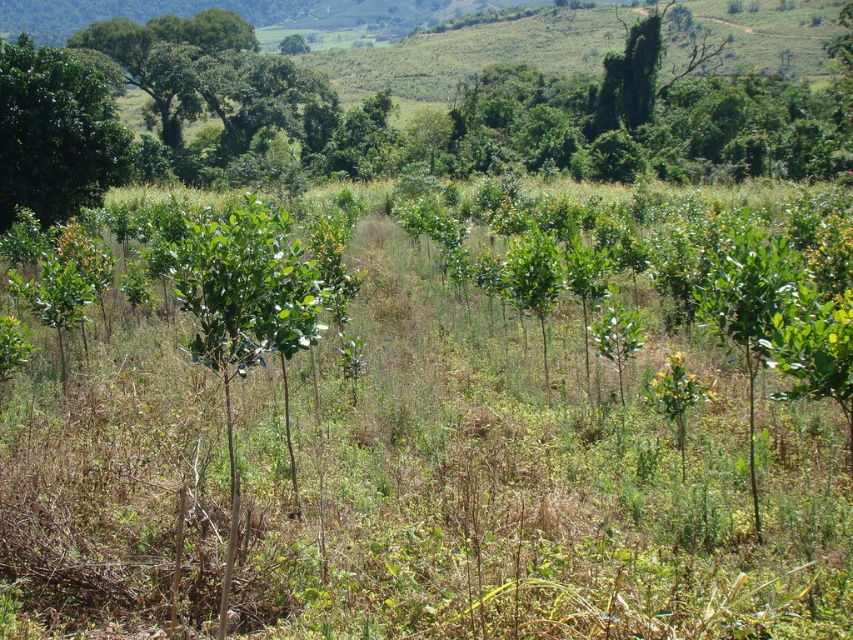
Is green leafy tree at upper left to the right of green leafy tree at upper center from the viewer's perspective?

Indeed, green leafy tree at upper left is positioned on the right side of green leafy tree at upper center.

Can you confirm if green leafy tree at upper left is positioned above green leafy tree at upper center?

Actually, green leafy tree at upper left is below green leafy tree at upper center.

Is point (65, 138) positioned before point (303, 49)?

Yes, it is in front of point (303, 49).

Find the location of a particular element. The image size is (853, 640). green leafy tree at upper left is located at coordinates (55, 132).